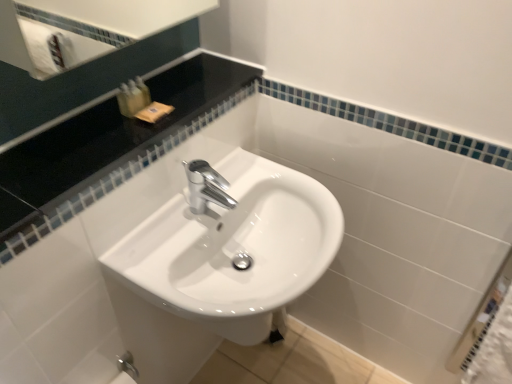
Locate an element on the screen. This screenshot has height=384, width=512. vacant space in front of polished chrome tap at center is located at coordinates (167, 251).